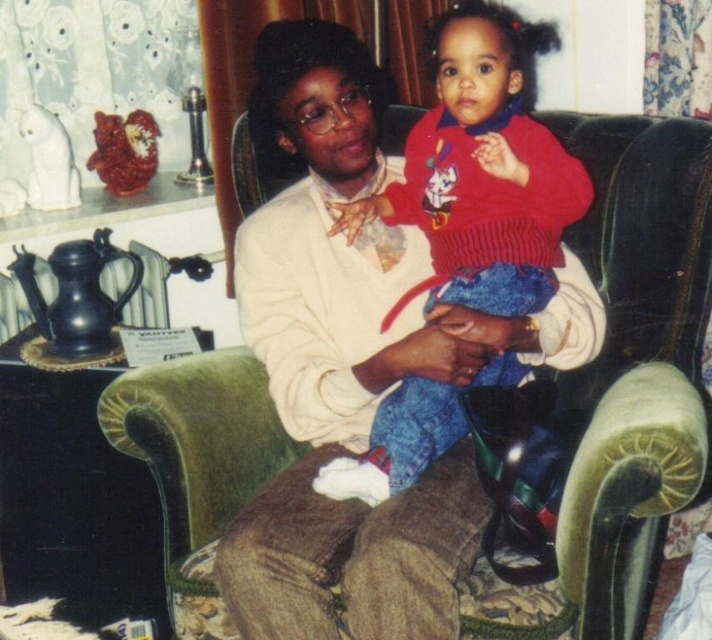
You are a delivery person who needs to place a rectangular package that is 1.2 meters wide on the velvet green couch at center. The red knit sweater at center is currently on the couch. Can the package fit on the couch without moving the sweater?

The velvet green couch at center is wider than the red knit sweater at center. Since the couch is wider than the sweater, there might be enough space to place the 1.2 meter wide package alongside or next to the sweater. However, the exact fit depends on the total width of the couch and the current position of the sweater. Without knowing the couches total width, we cannot confirm for certain.

You are a guest in the living room and want to sit down on the velvet green couch at center. However, there is a red knit sweater at center in your way. Is the sweater on the couch or in front of it?

The velvet green couch at center is in front of the red knit sweater at center, so the sweater is behind the couch and not on it. You can sit on the couch without moving the sweater.